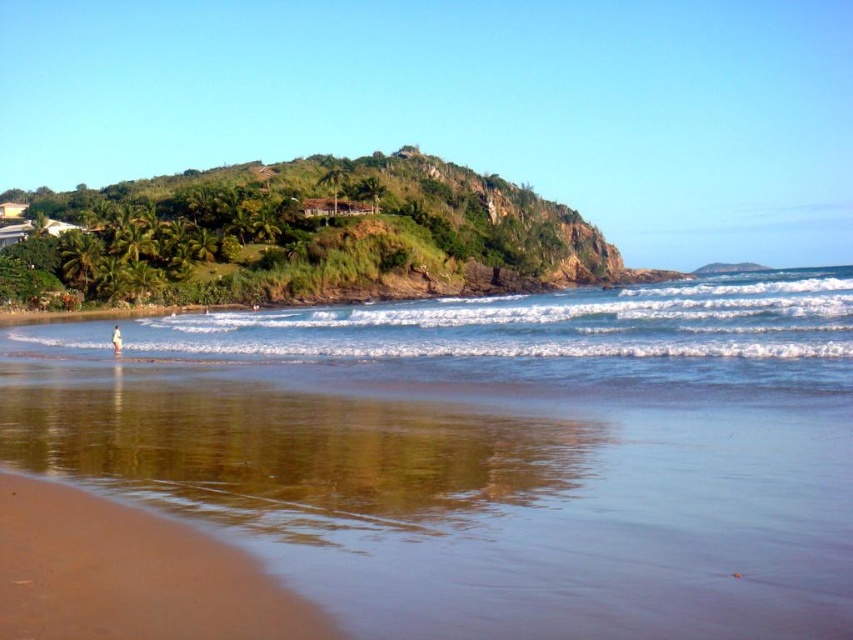
Question: Is clear blue water at center positioned before white sand at lower left?

Choices:
 (A) no
 (B) yes

Answer: (B)

Question: Which object is closer to the camera taking this photo?

Choices:
 (A) green grassy hill at upper center
 (B) white sand at lower left
 (C) brown sandy beach at lower left
 (D) clear blue water at center

Answer: (D)

Question: Can you confirm if clear blue water at center is bigger than white sand at lower left?

Choices:
 (A) no
 (B) yes

Answer: (B)

Question: Based on their relative distances, which object is farther from the clear blue water at center?

Choices:
 (A) brown sandy beach at lower left
 (B) green grassy hill at upper center
 (C) white sand at lower left

Answer: (B)

Question: Which point is farther from the camera taking this photo?

Choices:
 (A) (55, 280)
 (B) (181, 579)
 (C) (752, 524)
 (D) (119, 346)

Answer: (A)

Question: In this image, where is green grassy hill at upper center located relative to brown sandy beach at lower left?

Choices:
 (A) left
 (B) right

Answer: (A)